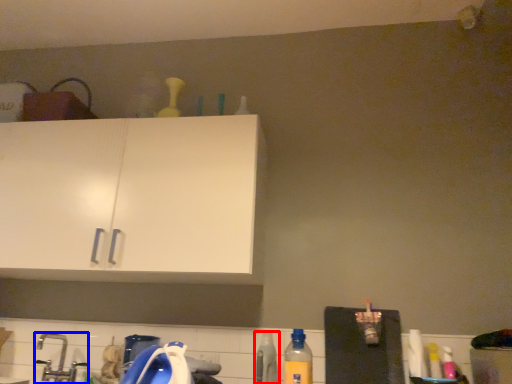
Question: Which object appears closest to the camera in this image, bottle (highlighted by a red box) or faucet (highlighted by a blue box)?

Choices:
 (A) bottle
 (B) faucet

Answer: (A)